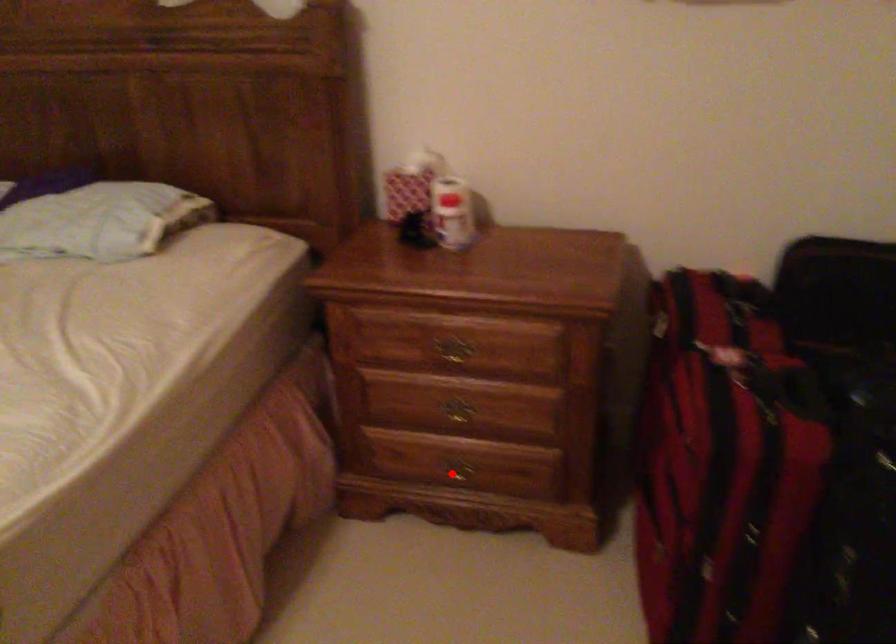
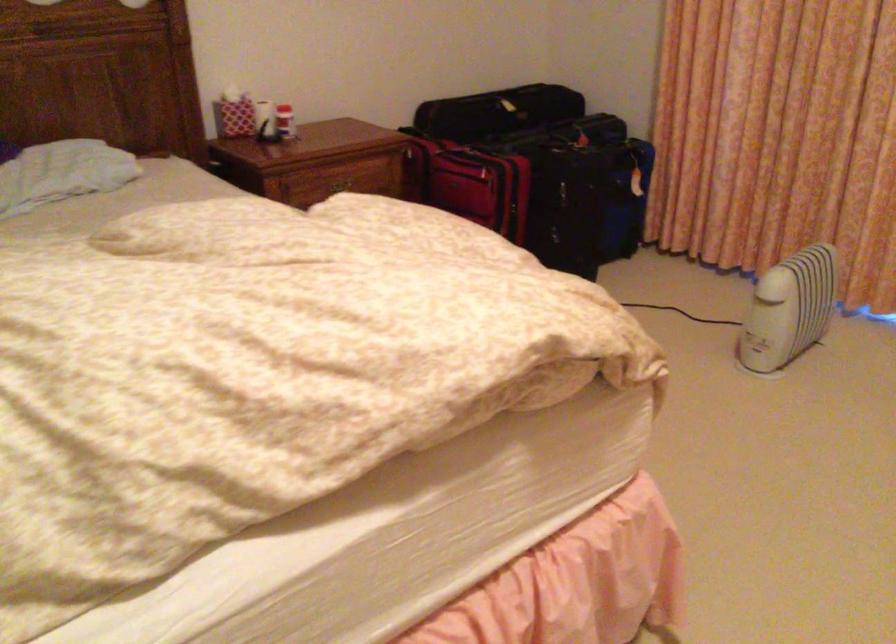
Question: I am providing you with two images of the same scene from different viewpoints. A red point is marked on the first image. At the location where the point appears in image 1, is it still visible in image 2?

Choices:
 (A) Yes
 (B) No

Answer: (B)